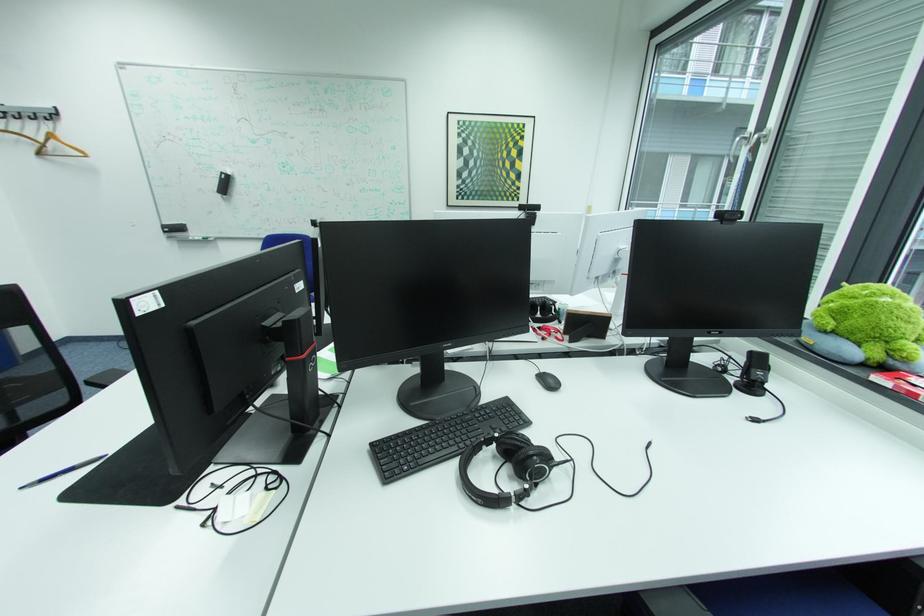
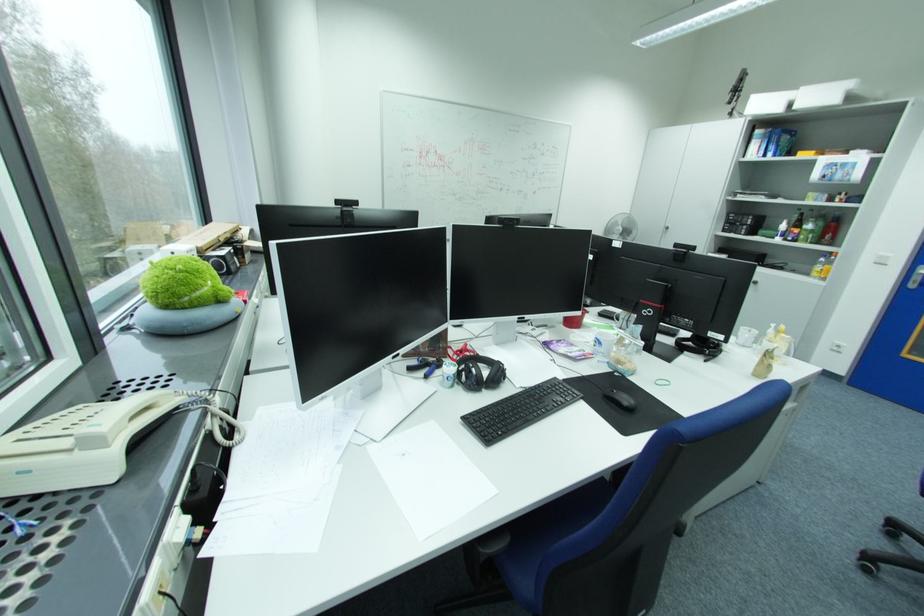
Question: I am providing you with two images of the same scene from different viewpoints. Please identify which objects are invisible in image2.

Choices:
 (A) yellow top bottle
 (B) bottle pump dispenser
 (C) white printed mug
 (D) blue and black pen

Answer: (D)